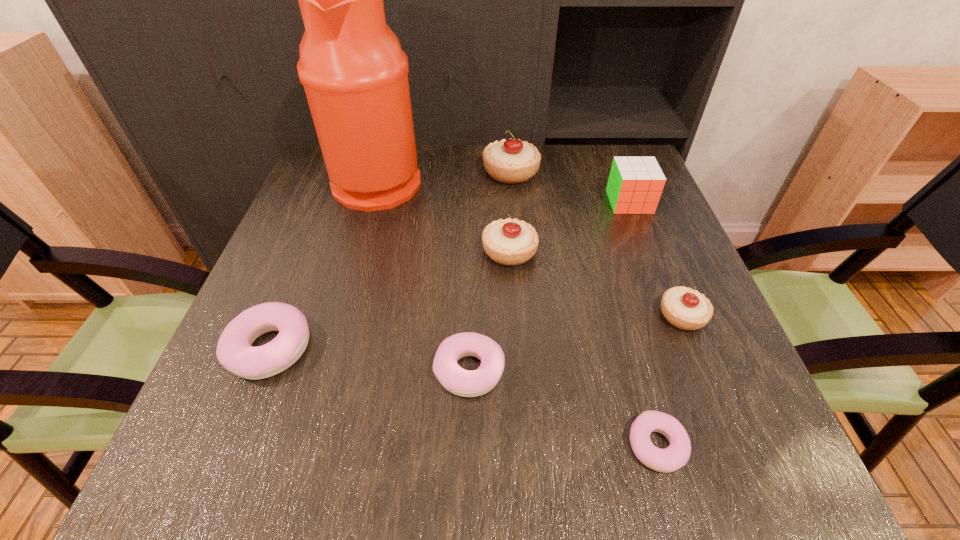
Image resolution: width=960 pixels, height=540 pixels. In order to click on vacant area between the second biggest pink pastry and the tallest pastry in this screenshot , I will do (490, 272).

Identify the location of free space that is in between the water jug and the second shortest object. (423, 275).

Locate an element on the screen. The width and height of the screenshot is (960, 540). vacant space that is in between the orange water jug and the second smallest pink pastry is located at coordinates coord(423,275).

The height and width of the screenshot is (540, 960). I want to click on free space between the nearest beige pastry and the second pink pastry from right to left, so click(x=576, y=343).

Identify the location of vacant region between the third shortest object and the cube. This screenshot has height=540, width=960. (450, 275).

Where is `vacant point located between the cube and the second shortest object`? The width and height of the screenshot is (960, 540). vacant point located between the cube and the second shortest object is located at coordinates (549, 286).

At what (x,y) coordinates should I click in order to perform the action: click on unoccupied position between the tallest pastry and the cube. Please return your answer as a coordinate pair (x, y). Image resolution: width=960 pixels, height=540 pixels. Looking at the image, I should click on (570, 187).

Point out which object is positioned as the third nearest to the nearest pink pastry. Please provide its 2D coordinates. Your answer should be formatted as a tuple, i.e. [(x, y)], where the tuple contains the x and y coordinates of a point satisfying the conditions above.

[(510, 242)]

This screenshot has width=960, height=540. I want to click on the closest object relative to the water jug, so click(511, 161).

Identify the location of the fourth closest pastry to the farthest beige pastry. (234, 351).